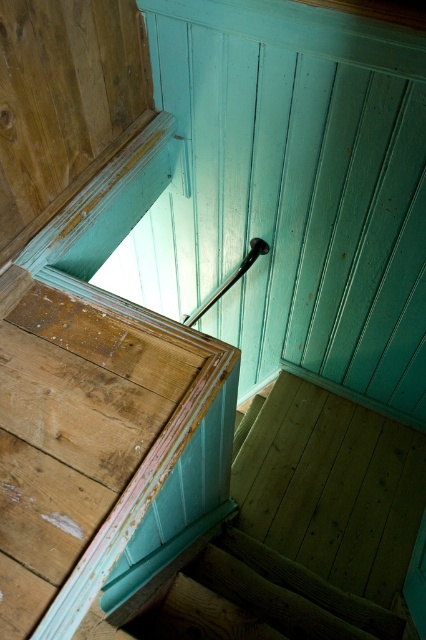
From the picture: You are standing at the bottom of the staircase and looking up. There is a wooden handrail at upper left located at point (103, 452). If you want to grab the handrail, which direction should you move your hand to reach it?

The wooden handrail at upper left is located at point (103, 452), so you should move your hand towards the upper left direction to reach it.

You are standing at the bottom of the staircase and want to reach the top. You see two points marked on the wall. The first point is at coordinate point (155, 404) and the second is at point (311, 625). Which point is closer to you?

Point (155, 404) is closer to the camera than point (311, 625), so the first point is closer to you.

You are standing at the bottom of the staircase and want to hold onto the handrails while climbing up. Which handrail should you grab first, the wooden handrail at upper left or the black glossy rail at upper center?

You should grab the wooden handrail at upper left first because it is positioned to the left of the black glossy rail at upper center, making it the first one you encounter as you climb up the stairs.